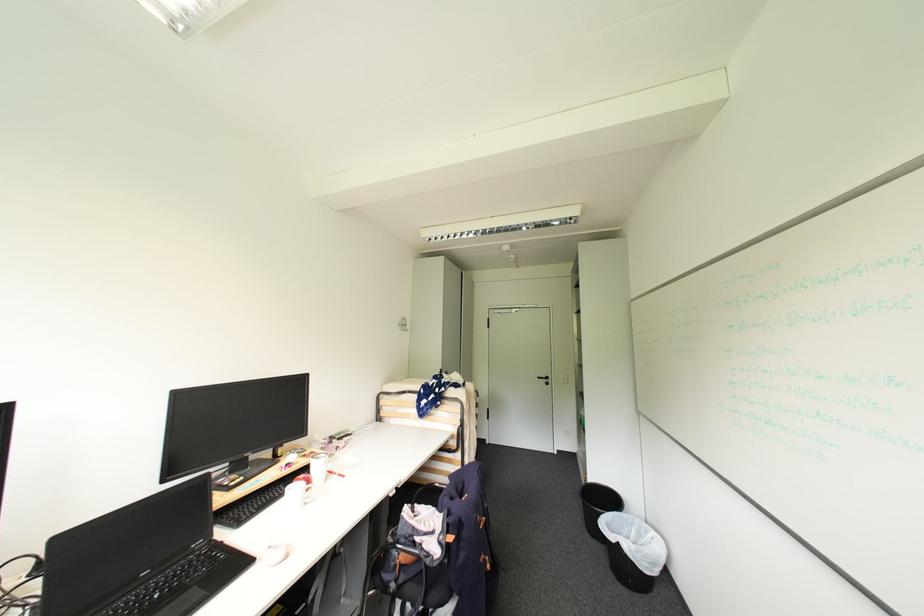
The image size is (924, 616). What do you see at coordinates (544, 379) in the screenshot? I see `the black door handle` at bounding box center [544, 379].